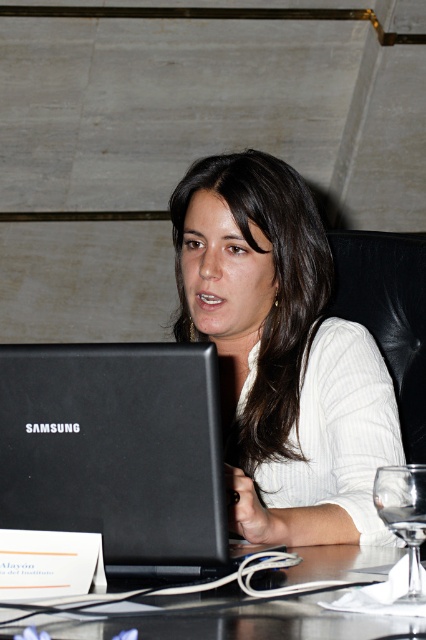
Does white matte shirt at center appear on the left side of transparent glass at lower right?

Correct, you'll find white matte shirt at center to the left of transparent glass at lower right.

From the picture: Is white matte shirt at center taller than transparent glass at lower right?

Yes.

At what (x,y) coordinates should I click in order to perform the action: click on white matte shirt at center. Please return your answer as a coordinate pair (x, y). This screenshot has width=426, height=640. Looking at the image, I should click on (282, 353).

Which is more to the left, black matte laptop at center or black glossy table at center?

black matte laptop at center

From the picture: Does black matte laptop at center appear on the right side of black glossy table at center?

Incorrect, black matte laptop at center is not on the right side of black glossy table at center.

What are the coordinates of `black matte laptop at center` in the screenshot? It's located at (118, 452).

This screenshot has height=640, width=426. Identify the location of black matte laptop at center. (118, 452).

Based on the photo, is white matte shirt at center above white ribbed sweater at center?

No, white matte shirt at center is not above white ribbed sweater at center.

Who is lower down, white matte shirt at center or white ribbed sweater at center?

white matte shirt at center

The height and width of the screenshot is (640, 426). What are the coordinates of `white matte shirt at center` in the screenshot? It's located at (282, 353).